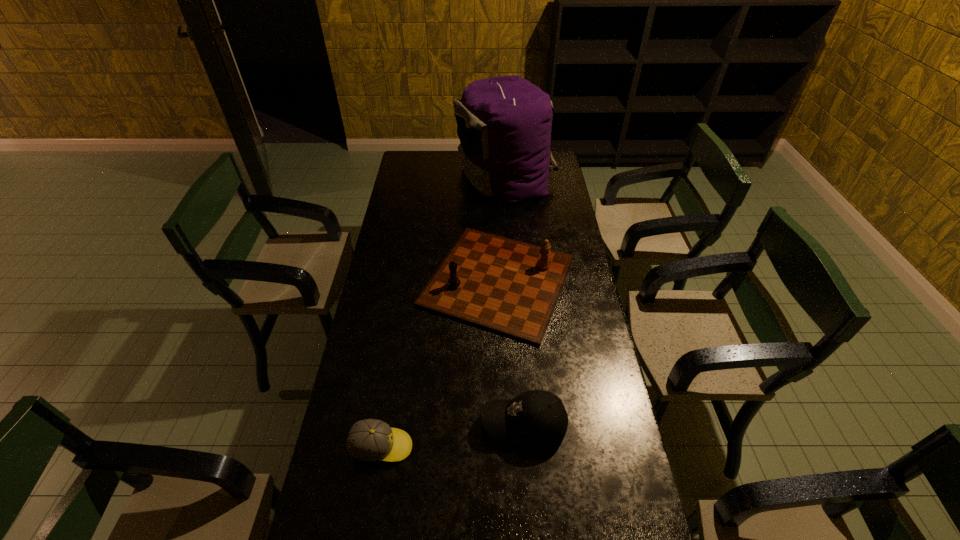
Where is `backpack`? This screenshot has height=540, width=960. backpack is located at coordinates (504, 124).

Locate an element on the screen. The height and width of the screenshot is (540, 960). the tallest object is located at coordinates (504, 124).

Locate an element on the screen. the second tallest object is located at coordinates (504, 285).

Find the location of a particular element. Image resolution: width=960 pixels, height=540 pixels. the second farthest object is located at coordinates (504, 285).

What are the coordinates of `the taller baseball cap` in the screenshot? It's located at (537, 418).

Locate an element on the screen. the right baseball cap is located at coordinates (537, 418).

I want to click on the left baseball cap, so click(x=372, y=440).

At what (x,y) coordinates should I click in order to perform the action: click on the shorter baseball cap. Please return your answer as a coordinate pair (x, y). This screenshot has height=540, width=960. Looking at the image, I should click on (372, 440).

The height and width of the screenshot is (540, 960). I want to click on vacant space situated 0.300m on the front pocket of the backpack, so click(396, 177).

At what (x,y) coordinates should I click in order to perform the action: click on free space located 0.270m on the front pocket of the backpack. Please return your answer as a coordinate pair (x, y). This screenshot has width=960, height=540. Looking at the image, I should click on (402, 177).